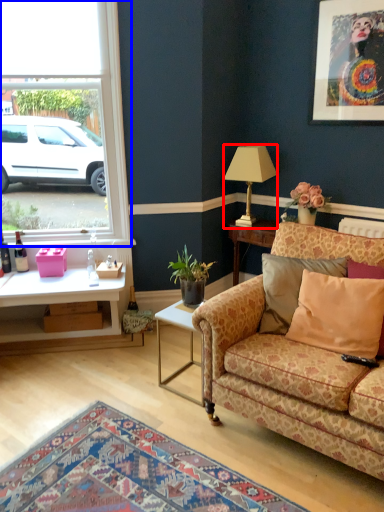
Question: Among these objects, which one is nearest to the camera, lamp (highlighted by a red box) or window (highlighted by a blue box)?

Choices:
 (A) lamp
 (B) window

Answer: (B)